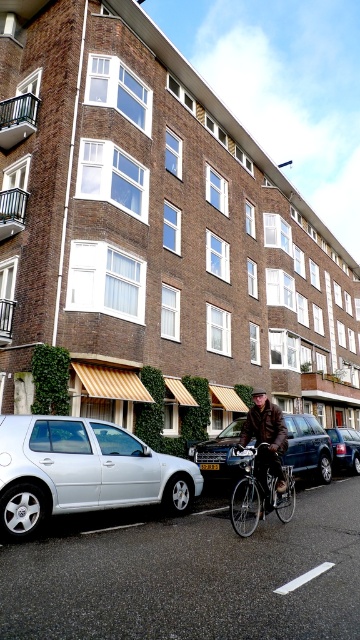
Question: Which object is positioned closest to the metallic silver car at center?

Choices:
 (A) silver metallic bicycle at center
 (B) brown leather jacket at center

Answer: (A)

Question: Can you confirm if metallic silver car at center is smaller than metallic silver sedan at center?

Choices:
 (A) yes
 (B) no

Answer: (A)

Question: Does white matte car at lower left lie in front of silver metallic bicycle at center?

Choices:
 (A) no
 (B) yes

Answer: (B)

Question: Is metallic silver car at center wider than metallic silver sedan at center?

Choices:
 (A) no
 (B) yes

Answer: (A)

Question: Which point is farther to the camera?

Choices:
 (A) click(266, 420)
 (B) click(342, 448)
 (C) click(257, 509)

Answer: (B)

Question: Which point is closer to the camera?

Choices:
 (A) (186, 509)
 (B) (349, 454)
 (C) (214, 468)
 (D) (321, 426)

Answer: (A)